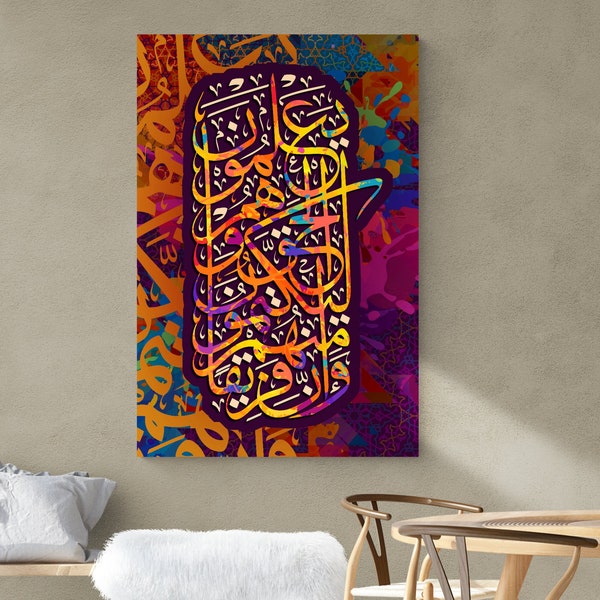
You are a GUI agent. You are given a task and a screenshot of the screen. Output one action in this format:
    pyautogui.click(x=<x>, y=<y>)
    Task: Click on the chair
    
    Given the screenshot: What is the action you would take?
    pyautogui.click(x=505, y=535), pyautogui.click(x=389, y=498)